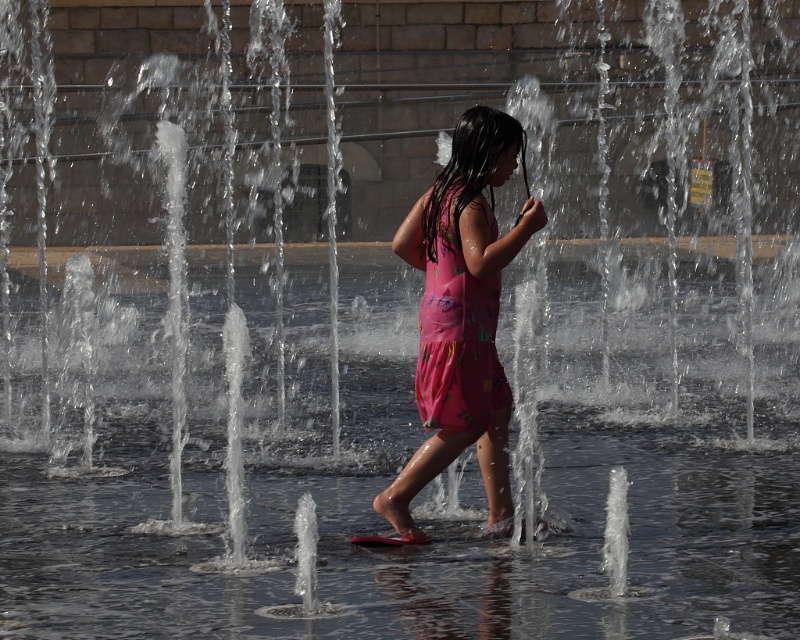
Is pink floral dress at center behind pink floral fabric dress at center?

No, pink floral dress at center is closer to the viewer.

Does pink floral dress at center have a lesser height compared to pink floral fabric dress at center?

No.

Measure the distance between pink floral dress at center and camera.

The distance of pink floral dress at center from camera is 9.83 meters.

Identify the location of pink floral dress at center. The width and height of the screenshot is (800, 640). (462, 312).